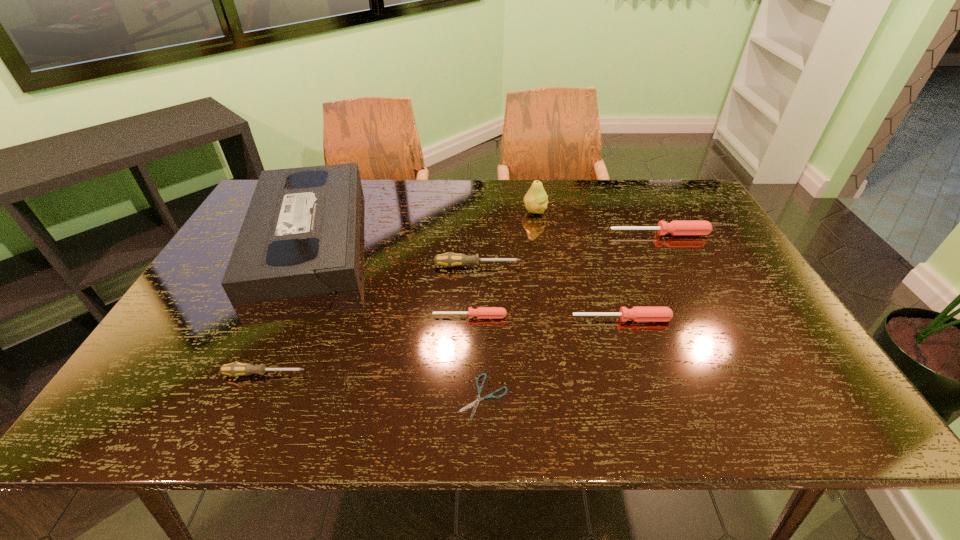
You are a GUI agent. You are given a task and a screenshot of the screen. Output one action in this format:
    pyautogui.click(x=<x>, y=<y>)
    Task: Click on the free location at the left edge of the desktop
    The width and height of the screenshot is (960, 540).
    Given the screenshot: What is the action you would take?
    pyautogui.click(x=165, y=383)

You are a GUI agent. You are given a task and a screenshot of the screen. Output one action in this format:
    pyautogui.click(x=<x>, y=<y>)
    Task: Click on the free space at the right edge of the desktop
    Image resolution: width=960 pixels, height=540 pixels.
    Given the screenshot: What is the action you would take?
    pyautogui.click(x=781, y=330)

I want to click on free spot between the farther gray screwdriver and the left gray screwdriver, so click(372, 320).

At what (x,y) coordinates should I click in order to perform the action: click on blank region between the videotape and the sixth object from left to right. Please return your answer as a coordinate pair (x, y). Image resolution: width=960 pixels, height=540 pixels. Looking at the image, I should click on (421, 222).

At what (x,y) coordinates should I click in order to perform the action: click on free space between the farthest screwdriver and the sixth object from left to right. Please return your answer as a coordinate pair (x, y). Looking at the image, I should click on (597, 222).

In order to click on free point between the shortest screwdriver and the farthest red screwdriver in this screenshot , I will do `click(564, 275)`.

Identify the location of vacant space that is in between the farthest screwdriver and the second shortest object. The height and width of the screenshot is (540, 960). (564, 275).

This screenshot has width=960, height=540. In order to click on vacant space that's between the shortest object and the leftmost screwdriver in this screenshot , I will do `click(373, 386)`.

Locate an element on the screen. Image resolution: width=960 pixels, height=540 pixels. blank region between the farther gray screwdriver and the tallest object is located at coordinates (506, 239).

Find the location of a particular element. The height and width of the screenshot is (540, 960). empty space that is in between the bigger gray screwdriver and the leftmost red screwdriver is located at coordinates (473, 291).